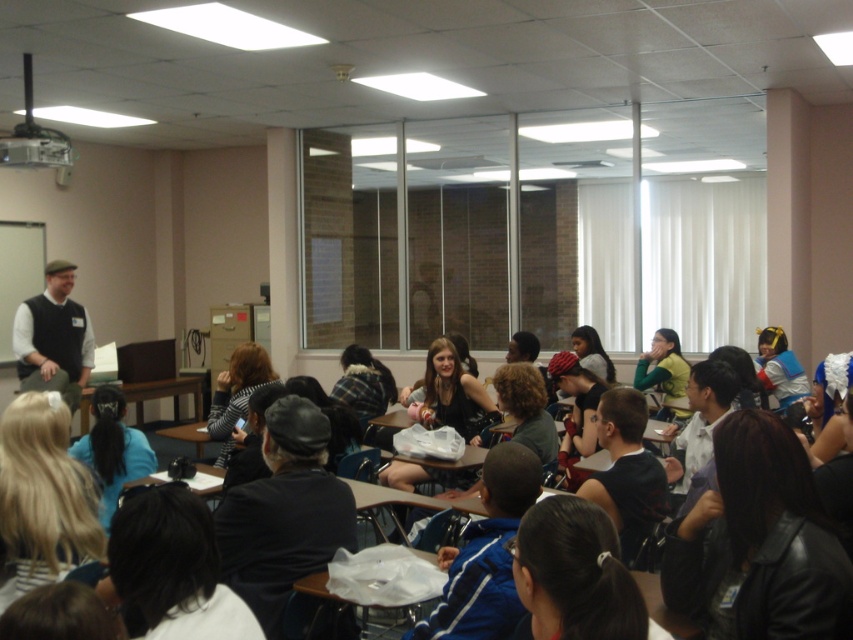
You are a student sitting at your desk in the classroom. You notice two points marked on the wall. The first point is at coordinates point (732, 481) and the second is at point (22, 374). Which point is closer to you?

The point at (732, 481) is closer to you than the point at (22, 374).

You are a student sitting at the back of the classroom. You notice a black leather jacket at lower right and a matte black vest at left. Which object is positioned further to the right from your perspective?

The black leather jacket at lower right is positioned further to the right than the matte black vest at left.

You are a student sitting at the desk in the middle of the classroom. You need to hand in an assignment to the person wearing the matte black vest at left. However, there is a black leather jacket at lower right in your way. Can you reach the person without moving the jacket?

The black leather jacket at lower right is closer to the viewer than the matte black vest at left, so you would need to move the jacket to reach the person wearing the matte black vest at left.